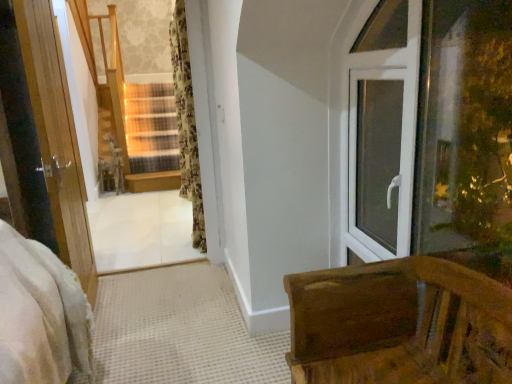
Question: Does wooden at center lie behind wooden bench at lower right?

Choices:
 (A) no
 (B) yes

Answer: (B)

Question: Is wooden at center next to wooden bench at lower right and touching it?

Choices:
 (A) no
 (B) yes

Answer: (A)

Question: Is wooden at center bigger than wooden bench at lower right?

Choices:
 (A) yes
 (B) no

Answer: (B)

Question: Is wooden at center to the left of wooden bench at lower right from the viewer's perspective?

Choices:
 (A) no
 (B) yes

Answer: (B)

Question: From the image's perspective, is wooden at center located beneath wooden bench at lower right?

Choices:
 (A) yes
 (B) no

Answer: (B)

Question: In the image, is floral fabric curtain at center positioned in front of or behind white plastic window at right?

Choices:
 (A) front
 (B) behind

Answer: (B)

Question: Visually, is floral fabric curtain at center positioned to the left or to the right of white plastic window at right?

Choices:
 (A) left
 (B) right

Answer: (A)

Question: Looking at their shapes, would you say floral fabric curtain at center is wider or thinner than white plastic window at right?

Choices:
 (A) wide
 (B) thin

Answer: (A)

Question: Considering the positions of point (188, 76) and point (372, 18), is point (188, 76) closer or farther from the camera than point (372, 18)?

Choices:
 (A) farther
 (B) closer

Answer: (A)

Question: Is point (404, 102) closer or farther from the camera than point (193, 201)?

Choices:
 (A) closer
 (B) farther

Answer: (A)

Question: Looking at their shapes, would you say white plastic window at right is wider or thinner than floral fabric curtain at center?

Choices:
 (A) thin
 (B) wide

Answer: (A)

Question: Considering the positions of white plastic window at right and floral fabric curtain at center in the image, is white plastic window at right taller or shorter than floral fabric curtain at center?

Choices:
 (A) short
 (B) tall

Answer: (A)

Question: From a real-world perspective, relative to floral fabric curtain at center, is white plastic window at right vertically above or below?

Choices:
 (A) above
 (B) below

Answer: (B)

Question: Is wooden bench at lower right inside or outside of floral fabric curtain at center?

Choices:
 (A) inside
 (B) outside

Answer: (B)

Question: Based on their sizes in the image, would you say wooden bench at lower right is bigger or smaller than floral fabric curtain at center?

Choices:
 (A) big
 (B) small

Answer: (A)